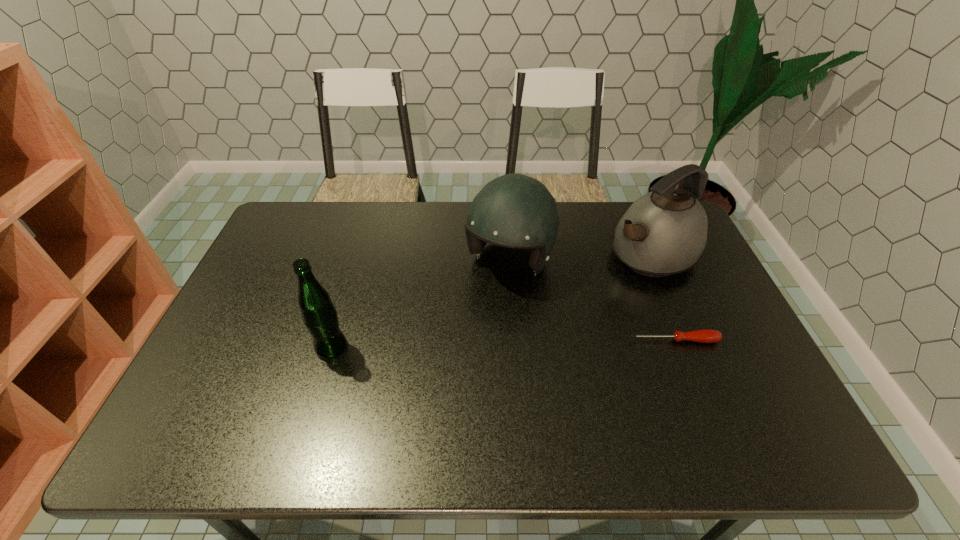
Find the location of `vacant area that lies between the screwdriver and the leftmost object`. vacant area that lies between the screwdriver and the leftmost object is located at coordinates (503, 344).

This screenshot has height=540, width=960. Find the location of `free space between the kettle and the shortest object`. free space between the kettle and the shortest object is located at coordinates (661, 298).

Locate an element on the screen. This screenshot has width=960, height=540. empty space between the leftmost object and the shortest object is located at coordinates (503, 344).

The image size is (960, 540). I want to click on free space between the football helmet and the kettle, so click(x=580, y=258).

Find the location of a particular element. The height and width of the screenshot is (540, 960). vacant space in between the leftmost object and the kettle is located at coordinates (491, 301).

Identify the location of blank region between the second object from left to right and the shortest object. (591, 300).

Find the location of `free space between the shortest object and the beer bottle`. free space between the shortest object and the beer bottle is located at coordinates [x=503, y=344].

Locate an element on the screen. The width and height of the screenshot is (960, 540). vacant area that lies between the leftmost object and the screwdriver is located at coordinates (503, 344).

Where is `free area in between the kettle and the leftmost object`? The width and height of the screenshot is (960, 540). free area in between the kettle and the leftmost object is located at coordinates (491, 301).

Where is `object that is the nearest to the kettle`? The width and height of the screenshot is (960, 540). object that is the nearest to the kettle is located at coordinates (514, 210).